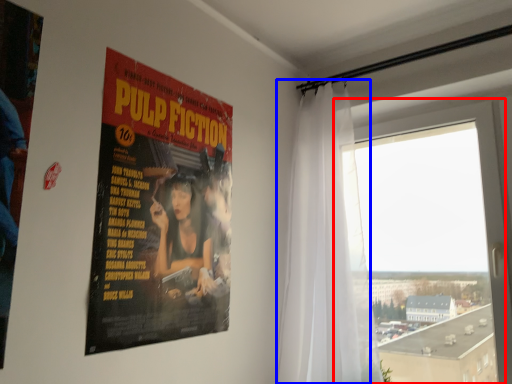
Question: Among these objects, which one is nearest to the camera, window (highlighted by a red box) or curtain (highlighted by a blue box)?

Choices:
 (A) window
 (B) curtain

Answer: (B)